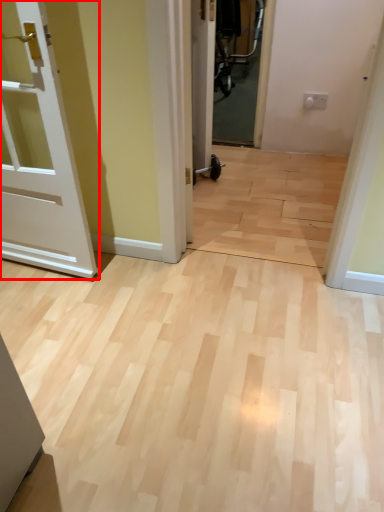
Question: From the image, what is the correct spatial relationship of door (annotated by the red box) in relation to door?

Choices:
 (A) right
 (B) left

Answer: (B)